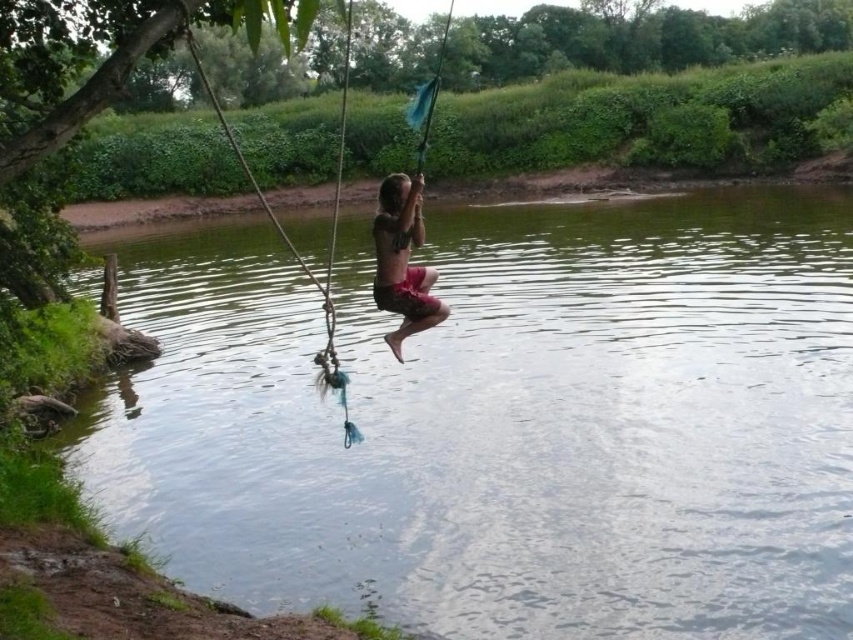
Based on the photo, you are standing at the origin point of the coordinate system. The swing ropes are tied to the tree branch on the left. Where is the clear water at center located in terms of coordinates?

The clear water at center is located at coordinates point [503,422].

You are planning to take a photo of the clear water at center and the rope swing at center from the left side of the frame. Which object will appear closer to the camera in the photo?

The rope swing at center will appear closer to the camera because it is taller than the clear water at center, making it occupy more space in the photo.

You are standing in the outdoor scene and want to touch the clear water at center and the matte red shorts at center. Which object can you reach first without moving your position?

The clear water at center is closer to the viewer than the matte red shorts at center, so you can reach the clear water at center first without moving.